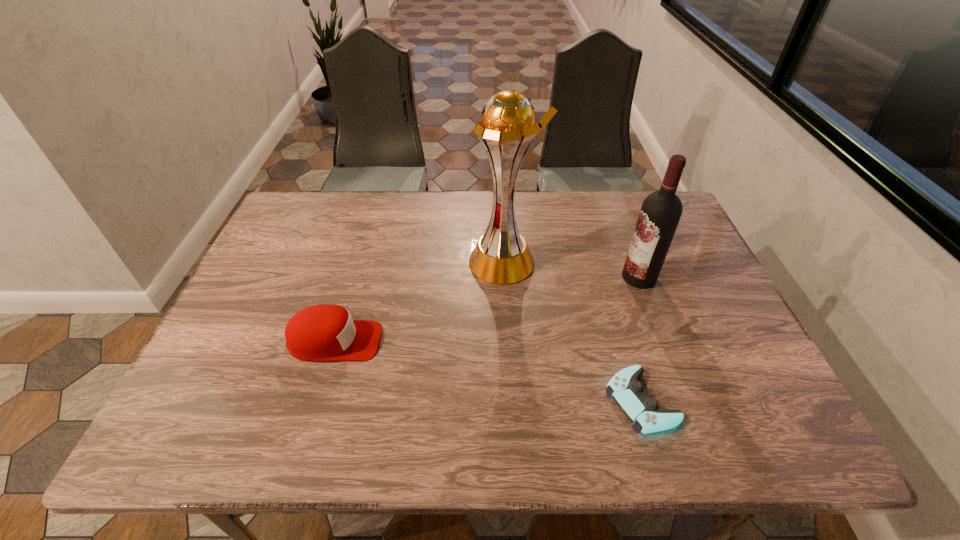
You are a GUI agent. You are given a task and a screenshot of the screen. Output one action in this format:
    pyautogui.click(x=<x>, y=<y>)
    Task: Click on the vacant space located 0.210m on the label of the wine bottle
    This screenshot has width=960, height=540.
    Given the screenshot: What is the action you would take?
    pyautogui.click(x=544, y=278)

Locate an element on the screen. vacant point located on the label of the wine bottle is located at coordinates (592, 278).

Find the location of a particular element. This screenshot has width=960, height=540. vacant space located on the label of the wine bottle is located at coordinates (548, 278).

You are a GUI agent. You are given a task and a screenshot of the screen. Output one action in this format:
    pyautogui.click(x=<x>, y=<y>)
    Task: Click on the vacant space located 0.100m on the front-facing side of the third tallest object
    Image resolution: width=960 pixels, height=540 pixels.
    Given the screenshot: What is the action you would take?
    pyautogui.click(x=423, y=341)

At what (x,y) coordinates should I click in order to perform the action: click on vacant position located on the back of the shortest object. Please return your answer as a coordinate pair (x, y). Image resolution: width=960 pixels, height=540 pixels. Looking at the image, I should click on (626, 352).

The width and height of the screenshot is (960, 540). Identify the location of object positioned at the near edge. (628, 393).

Locate an element on the screen. object that is at the right edge is located at coordinates (661, 211).

The image size is (960, 540). Identify the location of free space at the far edge of the desktop. (434, 199).

In the image, there is a desktop. At what (x,y) coordinates should I click in order to perform the action: click on vacant space at the near edge. Please return your answer as a coordinate pair (x, y). The image size is (960, 540). Looking at the image, I should click on (681, 436).

In the image, there is a desktop. Identify the location of free space at the left edge. (272, 252).